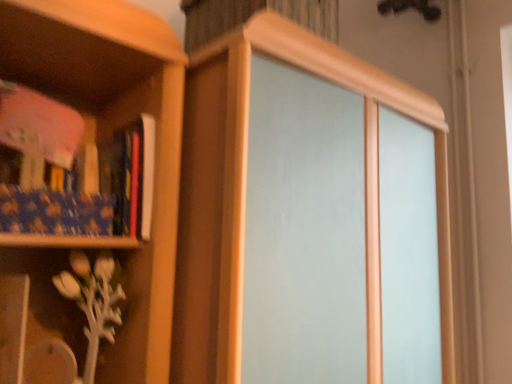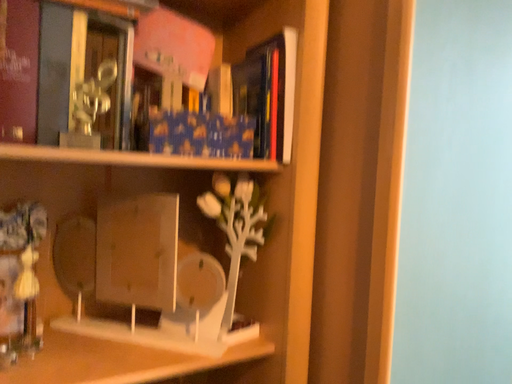
Question: How did the camera likely rotate when shooting the video?

Choices:
 (A) rotated left
 (B) rotated right

Answer: (A)